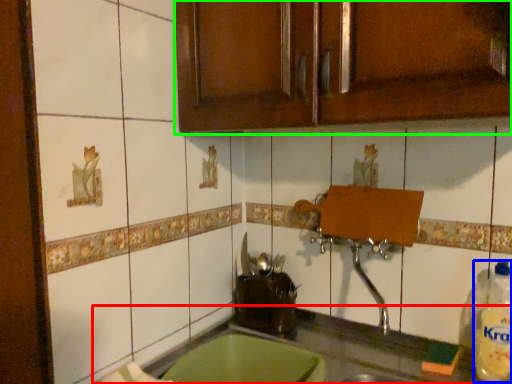
Question: Based on their relative distances, which object is farther from countertop (highlighted by a red box)? Choose from bottle (highlighted by a blue box) and cabinetry (highlighted by a green box).

Choices:
 (A) bottle
 (B) cabinetry

Answer: (B)